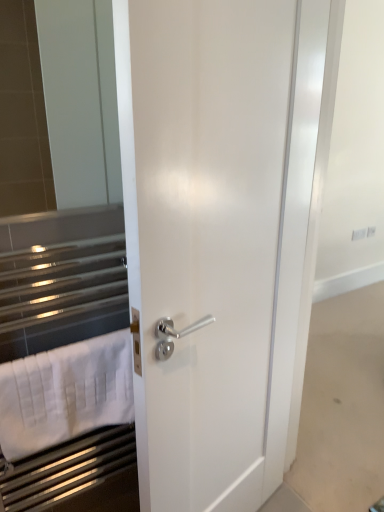
Question: Considering the positions of white cotton bath towel at left and white glossy door at center in the image, is white cotton bath towel at left wider or thinner than white glossy door at center?

Choices:
 (A) wide
 (B) thin

Answer: (B)

Question: Relative to white glossy door at center, is white cotton bath towel at left in front or behind?

Choices:
 (A) behind
 (B) front

Answer: (A)

Question: Would you say white cotton bath towel at left is to the left or to the right of white glossy door at center in the picture?

Choices:
 (A) left
 (B) right

Answer: (A)

Question: Considering the positions of point (266, 222) and point (54, 402), is point (266, 222) closer or farther from the camera than point (54, 402)?

Choices:
 (A) farther
 (B) closer

Answer: (A)

Question: Looking at the image, does white glossy door at center seem bigger or smaller compared to white cotton bath towel at left?

Choices:
 (A) small
 (B) big

Answer: (B)

Question: Visually, is white glossy door at center positioned to the left or to the right of white cotton bath towel at left?

Choices:
 (A) left
 (B) right

Answer: (B)

Question: Is white glossy door at center situated inside white cotton bath towel at left or outside?

Choices:
 (A) outside
 (B) inside

Answer: (A)